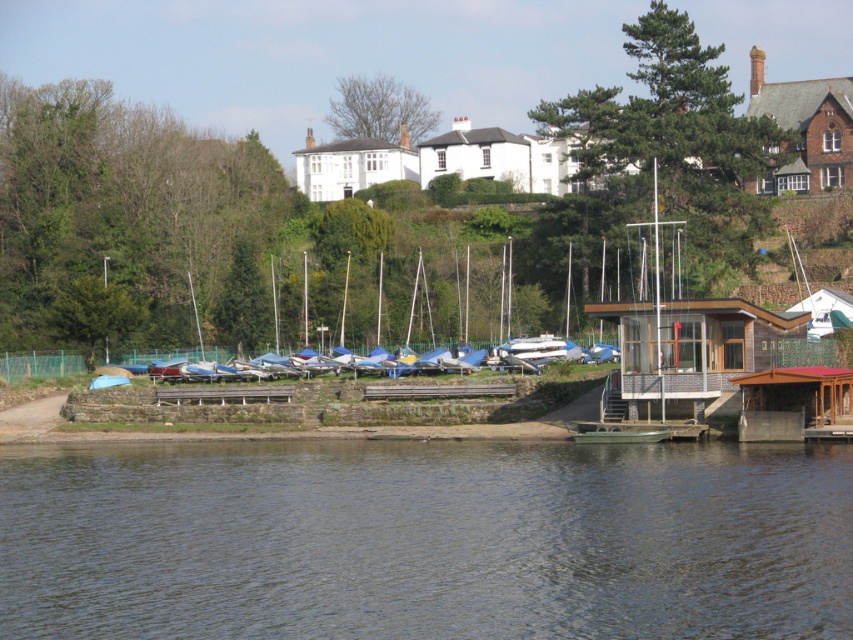
Question: In this image, where is green rubber boat at lower center located relative to brown wooden dock at lower right?

Choices:
 (A) below
 (B) above

Answer: (A)

Question: Which point is closer to the camera?

Choices:
 (A) brown wooden dock at lower right
 (B) green rubber boat at lower center

Answer: (B)

Question: Which of the following is the closest to the observer?

Choices:
 (A) (837, 397)
 (B) (389, 522)

Answer: (B)

Question: Can you confirm if green rubber boat at lower center is wider than brown wooden dock at lower right?

Choices:
 (A) no
 (B) yes

Answer: (B)

Question: Does green rubber boat at lower center appear over brown wooden dock at lower right?

Choices:
 (A) yes
 (B) no

Answer: (B)